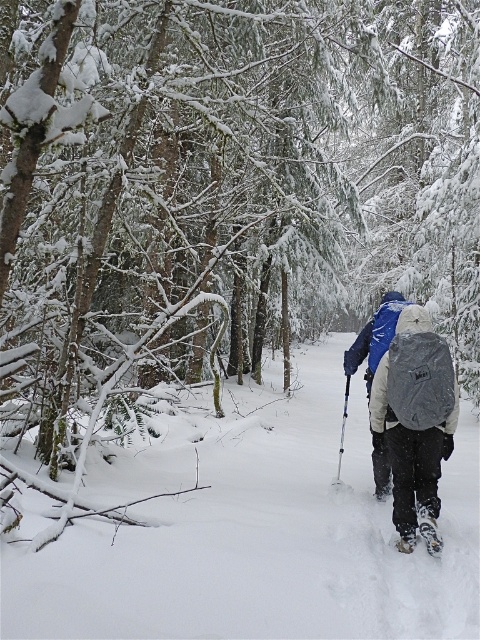
At what (x,y) coordinates should I click in order to perform the action: click on gray fabric backpack at center. Please return your answer as a coordinate pair (x, y). Looking at the image, I should click on (416, 419).

This screenshot has height=640, width=480. Find the location of `gray fabric backpack at center`. gray fabric backpack at center is located at coordinates (416, 419).

Which of these two, white plastic snowshoe at lower right or blue plastic ski pole at center, stands taller?

With more height is white plastic snowshoe at lower right.

Between point (430, 532) and point (348, 385), which one is positioned behind?

The point (348, 385) is more distant.

The width and height of the screenshot is (480, 640). Identify the location of white plastic snowshoe at lower right. [429, 531].

Which is more to the right, white fluffy snow at center or blue plastic ski pole at center?

blue plastic ski pole at center

The height and width of the screenshot is (640, 480). What do you see at coordinates (253, 529) in the screenshot?
I see `white fluffy snow at center` at bounding box center [253, 529].

Is point (436, 600) positioned behind point (343, 413)?

No, it is not.

Image resolution: width=480 pixels, height=640 pixels. In order to click on white fluffy snow at center in this screenshot , I will do `click(253, 529)`.